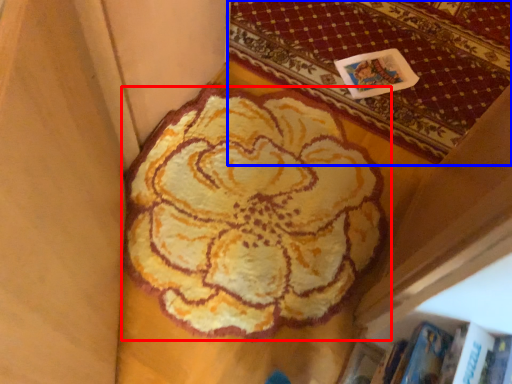
Question: Which object is further to the camera taking this photo, flower (highlighted by a red box) or mat (highlighted by a blue box)?

Choices:
 (A) flower
 (B) mat

Answer: (B)